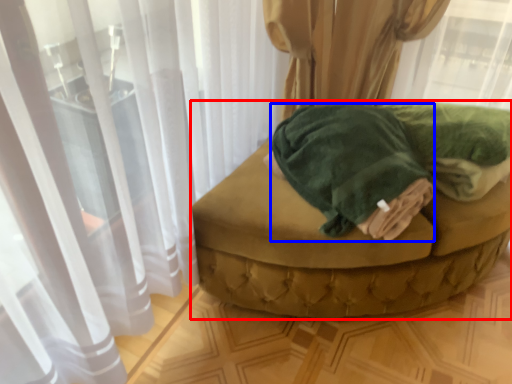
Question: Which point is further to the camera, furniture (highlighted by a red box) or bath towel (highlighted by a blue box)?

Choices:
 (A) furniture
 (B) bath towel

Answer: (A)